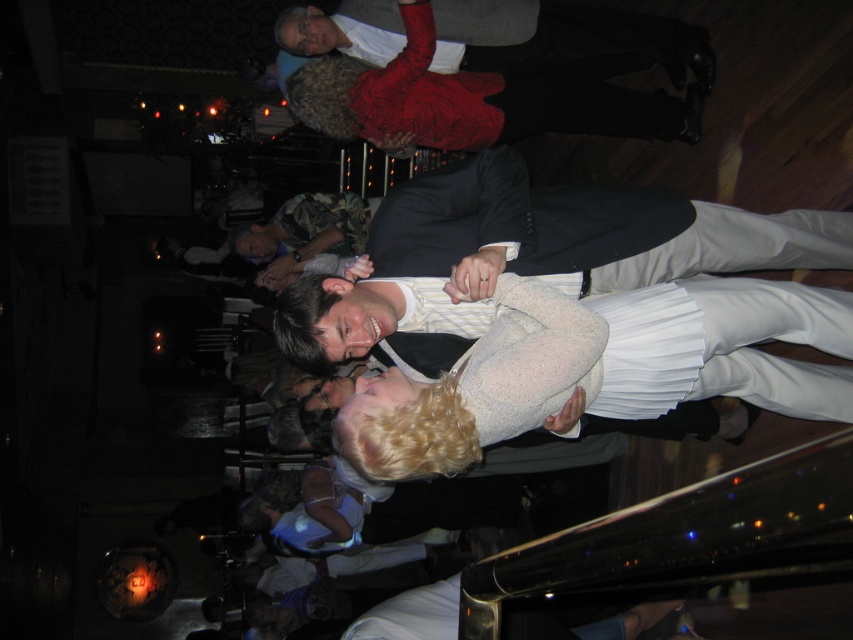
You are a photographer at a wedding reception. You want to capture a photo of the white pleated dress at center and the matte white shirt at upper center in the same frame. The camera you are using has a maximum focus range of 2 meters. Will both subjects be in focus if you take the photo now?

The distance between the white pleated dress at center and the matte white shirt at upper center is 1.91 meters, which is within the camera maximum focus range of 2 meters. Therefore, both subjects will be in focus.

You are a photographer standing at the event. You want to take a closeup shot of the white pleated dress at center without moving too far. Can you get a clear shot from your current position?

The white pleated dress at center is 1.72 meters away from the viewer, so yes, you can get a clear closeup shot from your current position since it is within a reasonable distance for photography.

Looking at this image, you are a photographer at a wedding reception. You notice the white pleated dress at center and the matte white shirt at upper center in your camera viewfinder. Which of these two items is positioned lower in the frame?

The white pleated dress at center is located below the matte white shirt at upper center, so the white pleated dress at center is positioned lower in the frame.